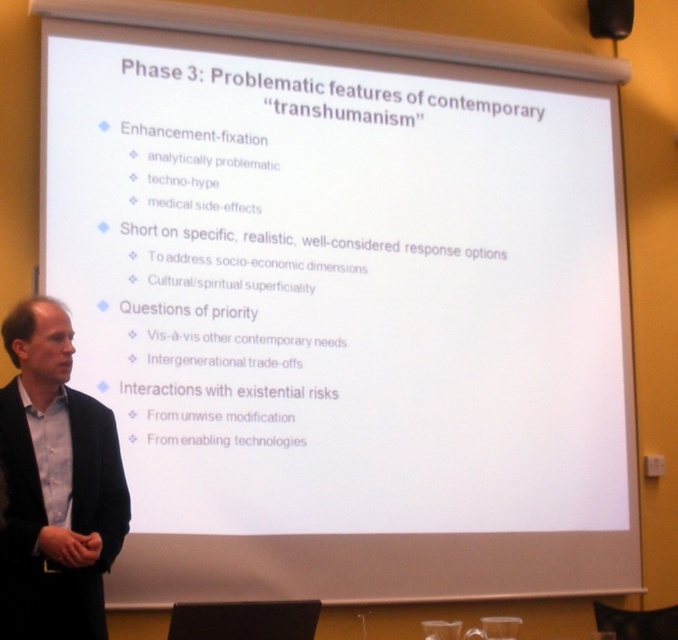
In the scene shown: You are sitting in the audience and notice the light blue shirt at left and the black matte speaker at upper right. Which object is taller in the image?

The light blue shirt at left is much taller than the black matte speaker at upper right.